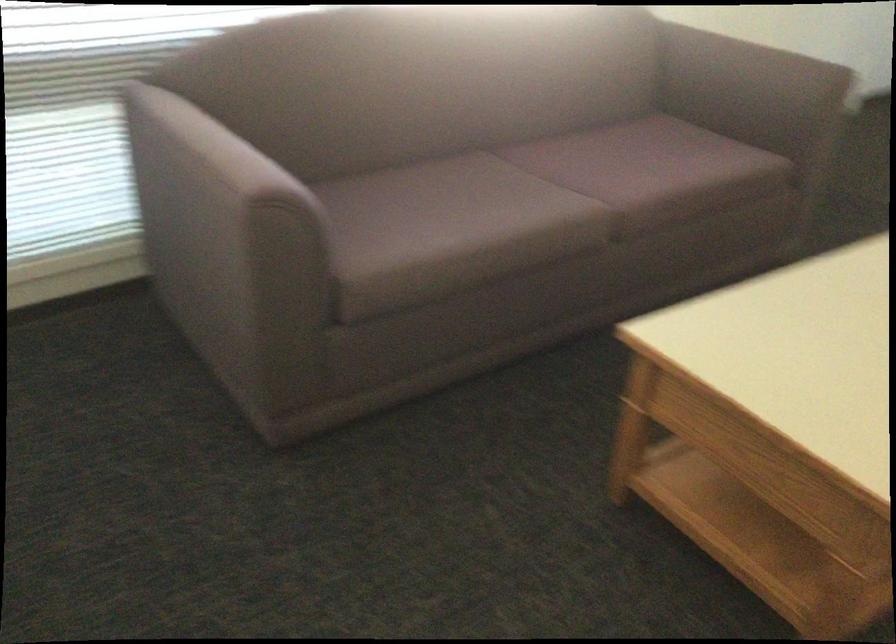
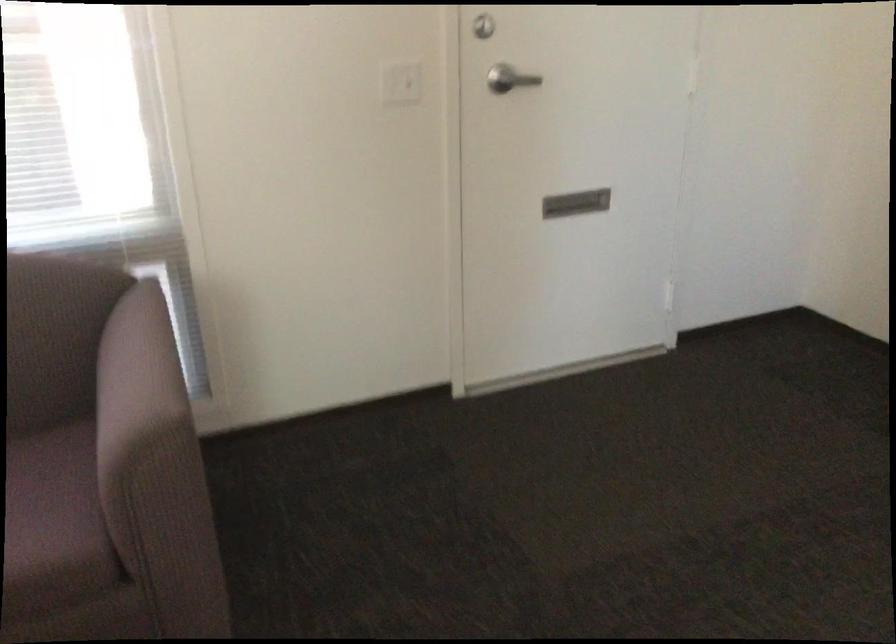
In the second image, find the point that corresponds to [736,149] in the first image.

(53, 520)